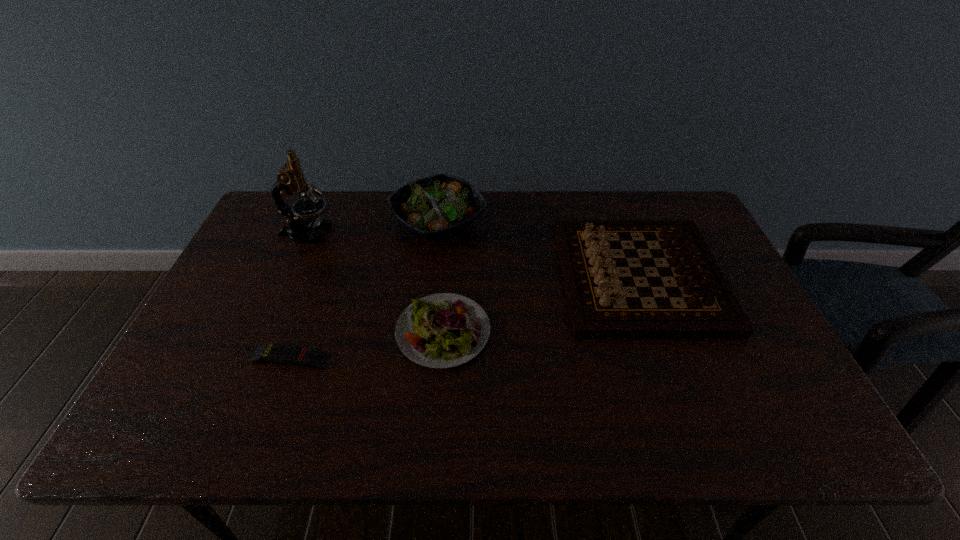
Where is `the tallest object`? the tallest object is located at coordinates (291, 178).

At what (x,y) coordinates should I click in order to perform the action: click on the taller salad plate. Please return your answer as a coordinate pair (x, y). Looking at the image, I should click on (433, 207).

The height and width of the screenshot is (540, 960). Find the location of `the rightmost object`. the rightmost object is located at coordinates (600, 305).

Identify the location of the nearer salad plate. (443, 330).

The width and height of the screenshot is (960, 540). In order to click on the fourth tallest object in this screenshot , I will do `click(443, 330)`.

Identify the location of remote control. (278, 353).

Where is `vacant region located 0.270m at the eyepiece of the microscope`? This screenshot has width=960, height=540. vacant region located 0.270m at the eyepiece of the microscope is located at coordinates (419, 233).

Locate an element on the screen. This screenshot has height=540, width=960. vacant area situated on the right of the taller salad plate is located at coordinates (525, 222).

The width and height of the screenshot is (960, 540). I want to click on free space located 0.200m on the side with the white pieces of the gameboard, so click(493, 277).

Find the location of `vacant space located on the side with the white pieces of the gameboard`. vacant space located on the side with the white pieces of the gameboard is located at coordinates (480, 277).